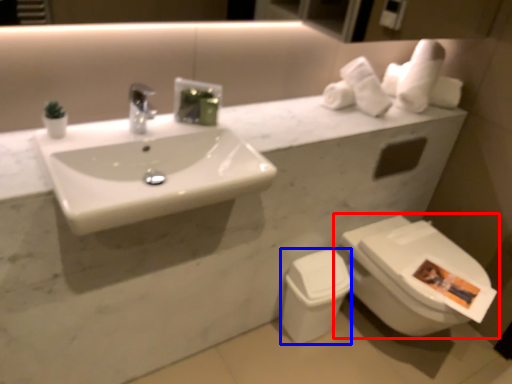
Question: Which point is further to the camera, toilet (highlighted by a red box) or toilet bowl (highlighted by a blue box)?

Choices:
 (A) toilet
 (B) toilet bowl

Answer: (B)